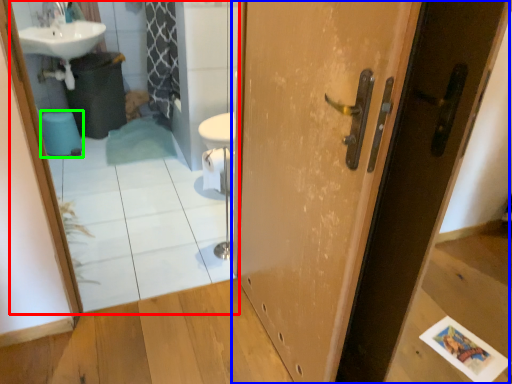
Question: Considering the real-world distances, which object is closest to mirror (highlighted by a red box)? door (highlighted by a blue box) or toilet bowl (highlighted by a green box).

Choices:
 (A) door
 (B) toilet bowl

Answer: (B)